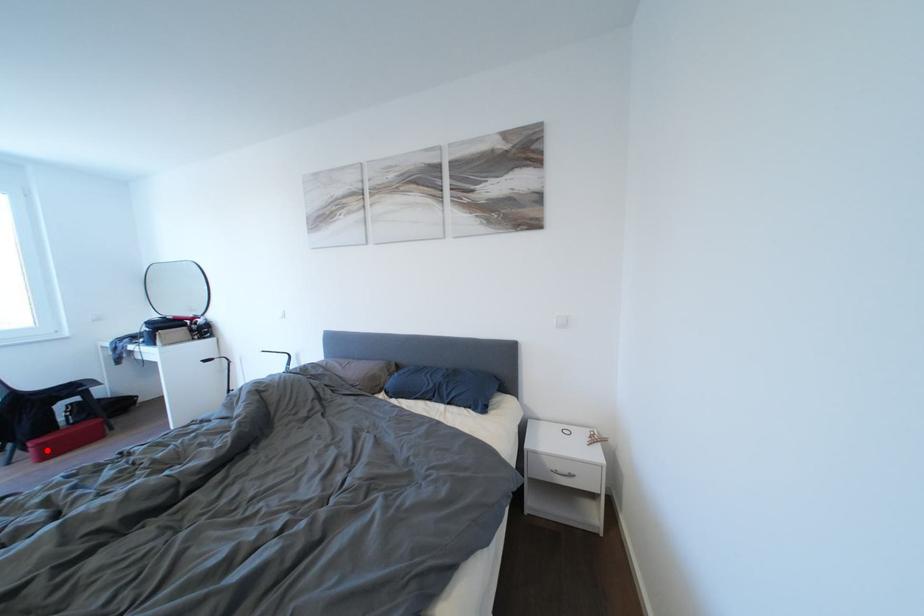
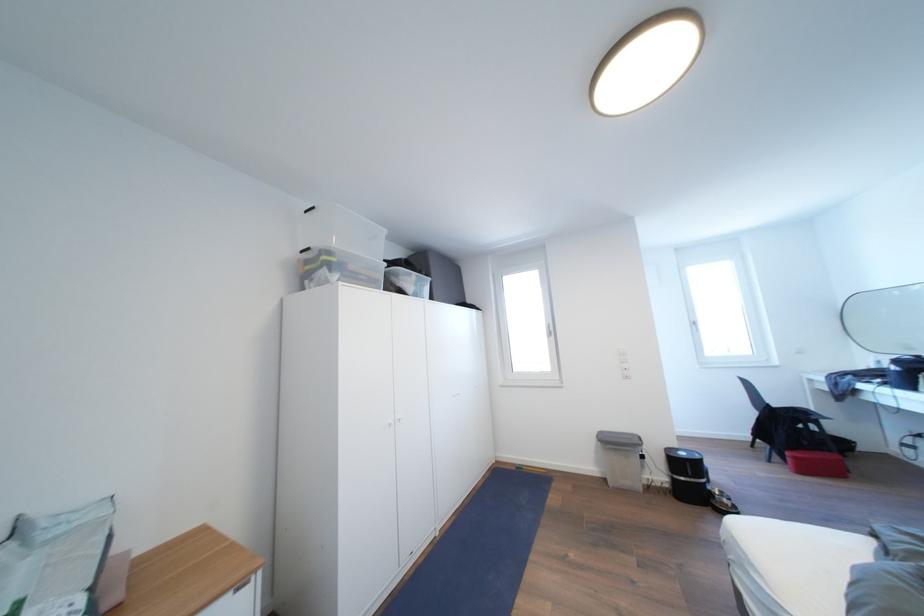
Question: I am providing you with two images of the same scene from different viewpoints. A red point is marked on the first image. Can you still see the location of the red point in image 2?

Choices:
 (A) Yes
 (B) No

Answer: (A)